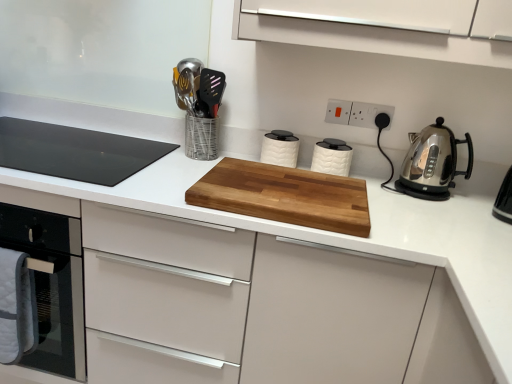
Question: Is black glass cooktop at left spatially inside white plastic electric outlet at upper center, the 2th electric outlet positioned from the right, or outside of it?

Choices:
 (A) outside
 (B) inside

Answer: (A)

Question: From a real-world perspective, is black glass cooktop at left physically located above or below white plastic electric outlet at upper center, arranged as the first electric outlet when viewed from the left?

Choices:
 (A) below
 (B) above

Answer: (A)

Question: Which object is the closest to the white textured canister at center, positioned as the second kitchen appliance in right-to-left order?

Choices:
 (A) black glass cooktop at left
 (B) white plastic electric outlet at upper center, the 2th electric outlet positioned from the right
 (C) polished stainless steel kettle at right, positioned as the third kitchen appliance in left-to-right order
 (D) metallic silver utensil holder at upper center
 (E) natural wood cutting board at center

Answer: (B)

Question: Estimate the real-world distances between objects in this image. Which object is farther from the white plastic electric outlet at upper center, arranged as the first electric outlet when viewed from the left?

Choices:
 (A) black glass cooktop at left
 (B) polished stainless steel kettle at right, which is the first kitchen appliance from right to left
 (C) white plastic electrical outlet at upper center, positioned as the second electric outlet in left-to-right order
 (D) white textured canister at center, the second kitchen appliance from the left
 (E) metallic silver utensil holder at upper center

Answer: (A)